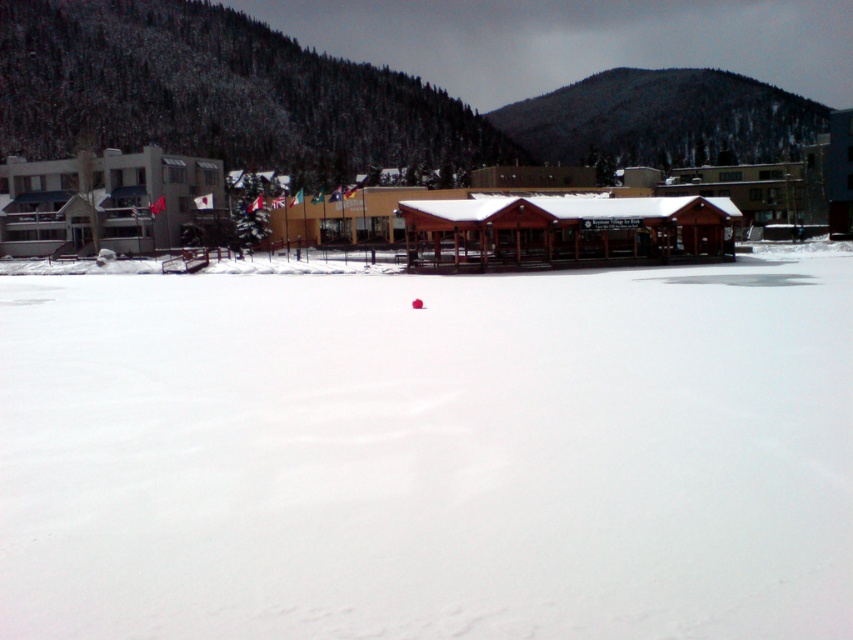
In the scene shown: You are planning to build a small cabin on the white snow at center and the brown wooden ski resort at center. Which location would be more stable for the cabin foundation?

The brown wooden ski resort at center would provide a more stable foundation for the cabin because it is positioned to the right of the white snow at center, which might be less stable due to its position on the left side.